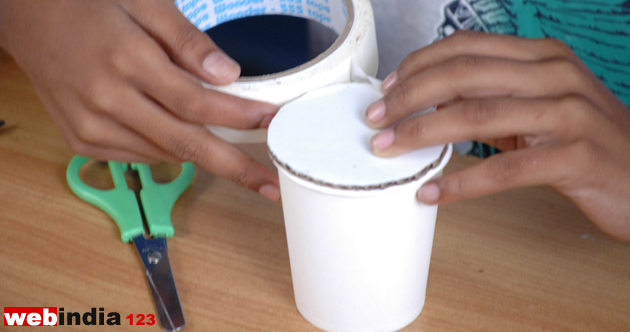
Where is `blue wall`? The image size is (630, 332). blue wall is located at coordinates (392, 25).